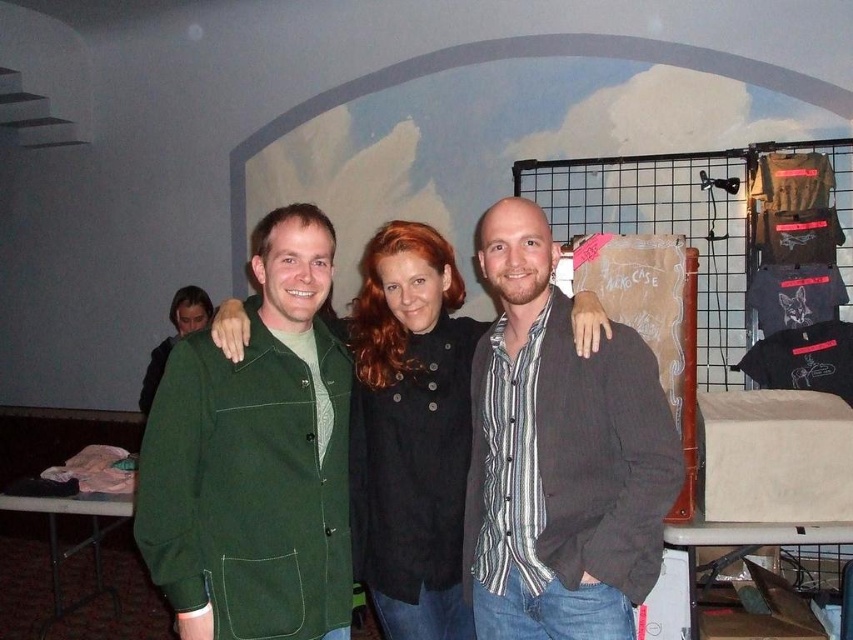
Question: Which point is closer to the camera?

Choices:
 (A) matte green jacket at left
 (B) striped cotton shirt at center

Answer: (B)

Question: Can you confirm if green corduroy jacket at center is positioned to the right of striped cotton shirt at center?

Choices:
 (A) no
 (B) yes

Answer: (A)

Question: Does striped cotton shirt at center appear over matte green jacket at left?

Choices:
 (A) yes
 (B) no

Answer: (B)

Question: Which point is farther from the camera taking this photo?

Choices:
 (A) (474, 378)
 (B) (169, 339)

Answer: (B)

Question: Which object is the farthest from the black matte jacket at center?

Choices:
 (A) green corduroy jacket at center
 (B) matte green jacket at left
 (C) striped cotton shirt at center

Answer: (B)

Question: Does green corduroy jacket at center have a lesser width compared to black matte jacket at center?

Choices:
 (A) no
 (B) yes

Answer: (A)